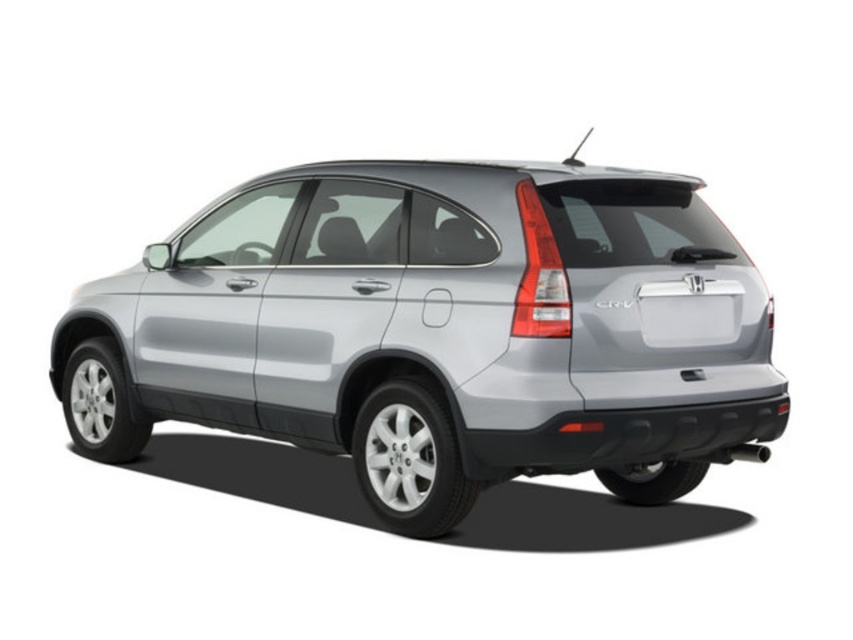
Which is below, satin silver suv at center or white plastic license plate at rear?

satin silver suv at center is lower down.

Between point (573, 225) and point (689, 321), which one is positioned behind?

Point (689, 321)

Between point (408, 432) and point (672, 316), which one is positioned behind?

The point (408, 432) is behind.

The image size is (853, 640). What are the coordinates of `satin silver suv at center` in the screenshot? It's located at (431, 332).